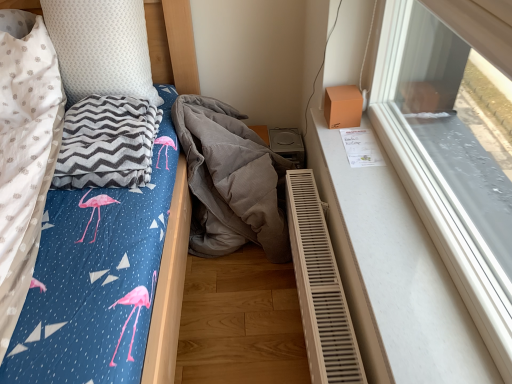
What do you see at coordinates (106, 143) in the screenshot? I see `gray zigzag blanket at left` at bounding box center [106, 143].

The image size is (512, 384). Identify the location of gray zigzag blanket at left. (106, 143).

What do you see at coordinates (230, 180) in the screenshot? The image size is (512, 384). I see `gray corduroy blanket at center` at bounding box center [230, 180].

Where is `transparent glass window at upper right`? transparent glass window at upper right is located at coordinates (446, 166).

I want to click on white dotted pillow at upper left, so click(101, 47).

At what (x,y) coordinates should I click in order to perform the action: click on gray zigzag blanket at left. Please return your answer as a coordinate pair (x, y). Image resolution: width=512 pixels, height=384 pixels. Looking at the image, I should click on (106, 143).

Considering the sizes of objects gray zigzag blanket at left and gray corduroy blanket at center in the image provided, who is bigger, gray zigzag blanket at left or gray corduroy blanket at center?

With larger size is gray corduroy blanket at center.

Between gray zigzag blanket at left and gray corduroy blanket at center, which one has larger width?

gray corduroy blanket at center.

Consider the image. From the image's perspective, between gray zigzag blanket at left and gray corduroy blanket at center, who is located below?

gray corduroy blanket at center appears lower in the image.

Who is taller, gray zigzag blanket at left or gray corduroy blanket at center?

gray corduroy blanket at center.

Looking at their sizes, would you say white dotted pillow at upper left is wider or thinner than gray corduroy blanket at center?

In the image, white dotted pillow at upper left appears to be more narrow than gray corduroy blanket at center.

Does point (111, 28) appear closer or farther from the camera than point (234, 224)?

Point (111, 28) is positioned closer to the camera compared to point (234, 224).

Find the location of a particular element. The height and width of the screenshot is (384, 512). pillow above the gray corduroy blanket at center (from the image's perspective) is located at coordinates (101, 47).

From the image's perspective, between gray corduroy blanket at center and gray zigzag blanket at left, who is located below?

gray corduroy blanket at center is shown below in the image.

Do you think gray corduroy blanket at center is within gray zigzag blanket at left, or outside of it?

gray corduroy blanket at center is located beyond the bounds of gray zigzag blanket at left.

How distant is gray corduroy blanket at center from gray zigzag blanket at left?

gray corduroy blanket at center is 13.37 inches away from gray zigzag blanket at left.

Is gray corduroy blanket at center next to gray zigzag blanket at left?

They are not placed beside each other.

Is beige plastic radiator at lower right placed right next to white dotted pillow at upper left?

No, beige plastic radiator at lower right is not beside white dotted pillow at upper left.

How far apart are beige plastic radiator at lower right and white dotted pillow at upper left?

beige plastic radiator at lower right is 32.31 inches away from white dotted pillow at upper left.

Visually, is beige plastic radiator at lower right positioned to the left or to the right of white dotted pillow at upper left?

Based on their positions, beige plastic radiator at lower right is located to the right of white dotted pillow at upper left.

How different are the orientations of beige plastic radiator at lower right and white dotted pillow at upper left in degrees?

They differ by 89.7 degrees in their facing directions.

Is point (117, 182) positioned behind point (492, 256)?

Yes.

Relative to transparent glass window at upper right, is gray zigzag blanket at left in front or behind?

Clearly, gray zigzag blanket at left is behind transparent glass window at upper right.

Is gray zigzag blanket at left inside or outside of transparent glass window at upper right?

gray zigzag blanket at left is located beyond the bounds of transparent glass window at upper right.

Where is `window on the right of gray zigzag blanket at left`? This screenshot has width=512, height=384. window on the right of gray zigzag blanket at left is located at coordinates (446, 166).

Is transparent glass window at upper right surrounded by white dotted pillow at upper left?

Definitely not — transparent glass window at upper right is not inside white dotted pillow at upper left.

From the image's perspective, is white dotted pillow at upper left above or below transparent glass window at upper right?

From the image's perspective, white dotted pillow at upper left appears above transparent glass window at upper right.

Between white dotted pillow at upper left and transparent glass window at upper right, which one has larger width?

white dotted pillow at upper left.

From a real-world perspective, which object stands above the other?

transparent glass window at upper right, from a real-world perspective.

Would you say beige plastic radiator at lower right is part of transparent glass window at upper right's contents?

That's incorrect, beige plastic radiator at lower right is not inside transparent glass window at upper right.

Locate an element on the screen. The height and width of the screenshot is (384, 512). radiator directly beneath the transparent glass window at upper right (from a real-world perspective) is located at coordinates (320, 288).

This screenshot has height=384, width=512. In order to click on material behind the gray zigzag blanket at left in this screenshot , I will do `click(230, 180)`.

You are a GUI agent. You are given a task and a screenshot of the screen. Output one action in this format:
    pyautogui.click(x=<x>, y=<y>)
    Task: Click on the pillow above the gray corduroy blanket at center (from the image's perspective)
    Image resolution: width=512 pixels, height=384 pixels.
    Given the screenshot: What is the action you would take?
    pyautogui.click(x=101, y=47)

Which object lies nearer to the anchor point gray corduroy blanket at center, gray zigzag blanket at left or transparent glass window at upper right?

Based on the image, gray zigzag blanket at left appears to be nearer to gray corduroy blanket at center.

Which object lies further to the anchor point white dotted pillow at upper left, gray corduroy blanket at center or transparent glass window at upper right?

transparent glass window at upper right lies further to white dotted pillow at upper left than the other object.

Which object lies nearer to the anchor point beige plastic radiator at lower right, white dotted pillow at upper left or gray zigzag blanket at left?

Based on the image, gray zigzag blanket at left appears to be nearer to beige plastic radiator at lower right.

Looking at the image, which one is located further to white dotted pillow at upper left, gray zigzag blanket at left or beige plastic radiator at lower right?

Based on the image, beige plastic radiator at lower right appears to be further to white dotted pillow at upper left.

Which object lies further to the anchor point transparent glass window at upper right, gray corduroy blanket at center or white dotted pillow at upper left?

Based on the image, white dotted pillow at upper left appears to be further to transparent glass window at upper right.

Which object lies nearer to the anchor point gray corduroy blanket at center, beige plastic radiator at lower right or gray zigzag blanket at left?

beige plastic radiator at lower right is closer to gray corduroy blanket at center.

Which object lies further to the anchor point white dotted pillow at upper left, transparent glass window at upper right or beige plastic radiator at lower right?

Among the two, transparent glass window at upper right is located further to white dotted pillow at upper left.

From the picture: From the image, which object appears to be nearer to beige plastic radiator at lower right, gray corduroy blanket at center or transparent glass window at upper right?

gray corduroy blanket at center.

The width and height of the screenshot is (512, 384). Identify the location of radiator between transparent glass window at upper right and white dotted pillow at upper left along the z-axis. (320, 288).

Image resolution: width=512 pixels, height=384 pixels. I want to click on blanket between transparent glass window at upper right and gray corduroy blanket at center from front to back, so click(x=106, y=143).

You are a GUI agent. You are given a task and a screenshot of the screen. Output one action in this format:
    pyautogui.click(x=<x>, y=<y>)
    Task: Click on the material located between gray zigzag blanket at left and beige plastic radiator at lower right in the left-right direction
    
    Given the screenshot: What is the action you would take?
    pyautogui.click(x=230, y=180)

The width and height of the screenshot is (512, 384). I want to click on blanket situated between white dotted pillow at upper left and beige plastic radiator at lower right from left to right, so click(106, 143).